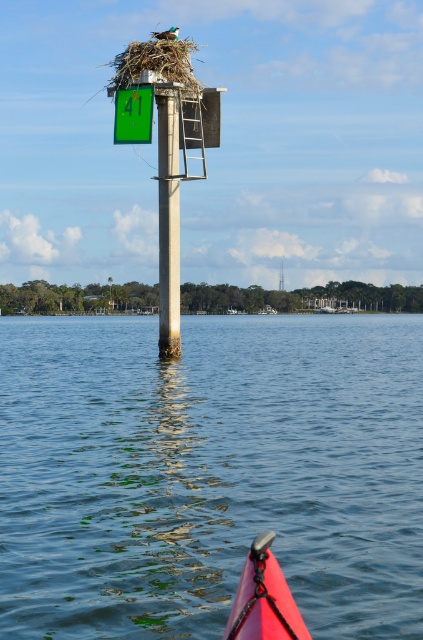
Question: Is blue water at center bigger than concrete pole at center?

Choices:
 (A) yes
 (B) no

Answer: (A)

Question: Which of the following is the farthest from the observer?

Choices:
 (A) blue water at center
 (B) rubberized pink kayak at lower center
 (C) concrete pole at center

Answer: (C)

Question: In this image, where is blue water at center located relative to concrete pole at center?

Choices:
 (A) right
 (B) left

Answer: (A)

Question: Estimate the real-world distances between objects in this image. Which object is closer to the rubberized pink kayak at lower center?

Choices:
 (A) blue water at center
 (B) concrete pole at center

Answer: (B)

Question: Is blue water at center to the right of concrete pole at center from the viewer's perspective?

Choices:
 (A) no
 (B) yes

Answer: (B)

Question: Which object is closer to the camera taking this photo?

Choices:
 (A) blue water at center
 (B) rubberized pink kayak at lower center
 (C) concrete pole at center

Answer: (B)